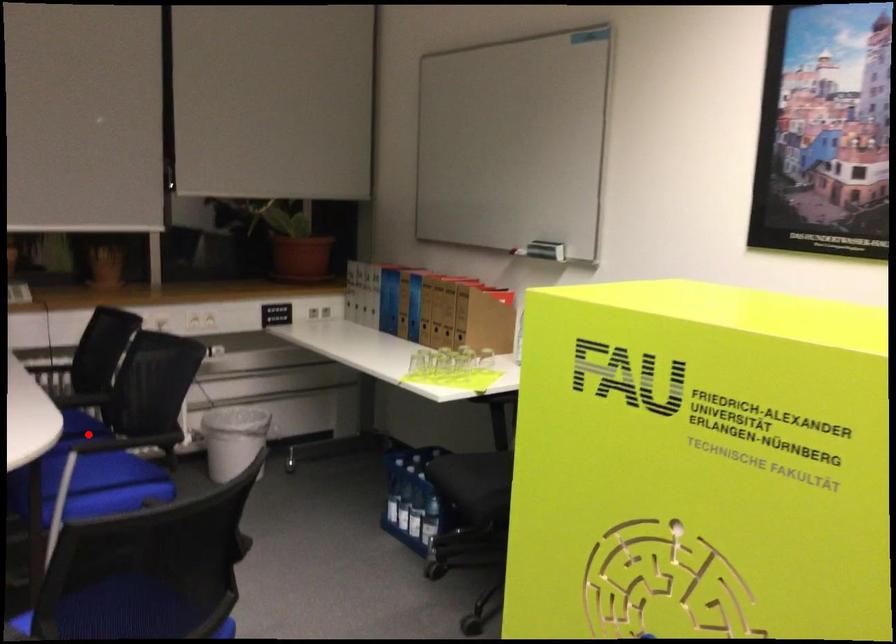
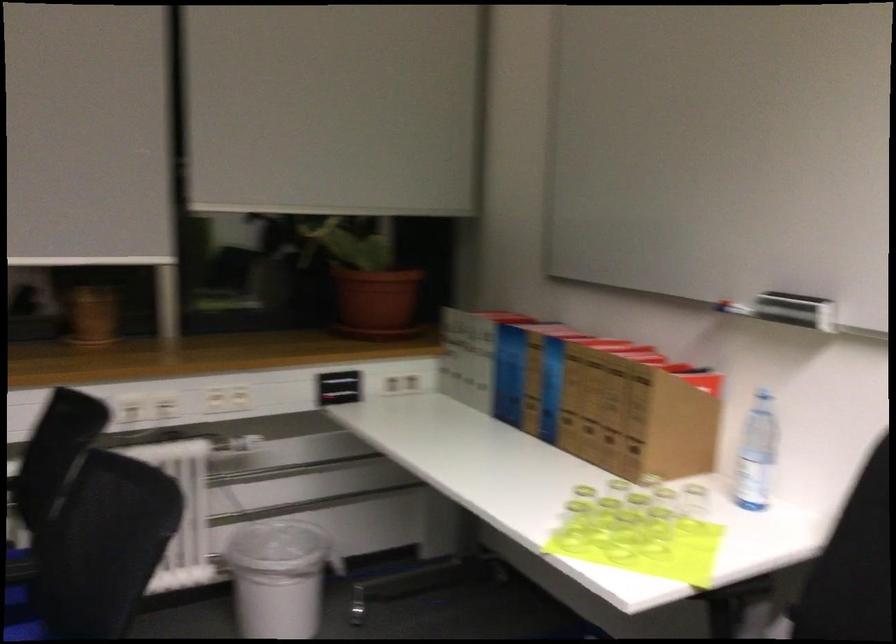
Question: A red point is marked in image1. In image2, is the corresponding 3D point closer to the camera or farther? Reply with the corresponding letter.

Choices:
 (A) The corresponding 3D point is closer.
 (B) The corresponding 3D point is farther.

Answer: (A)